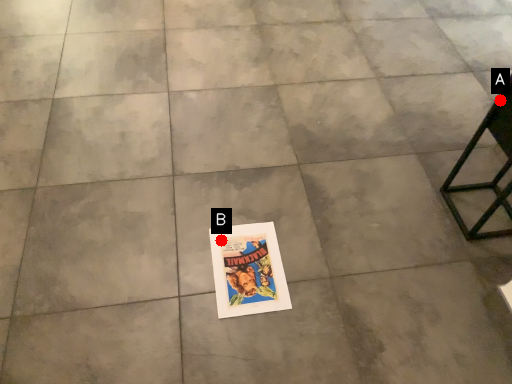
Question: Two points are circled on the image, labeled by A and B beside each circle. Which of the following is the closest to the observer?

Choices:
 (A) A is closer
 (B) B is closer

Answer: (B)